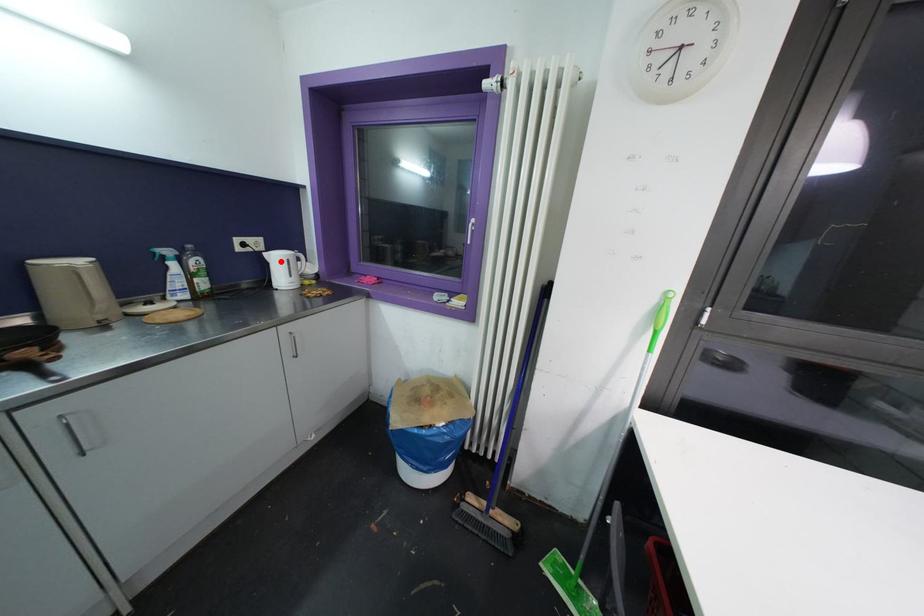
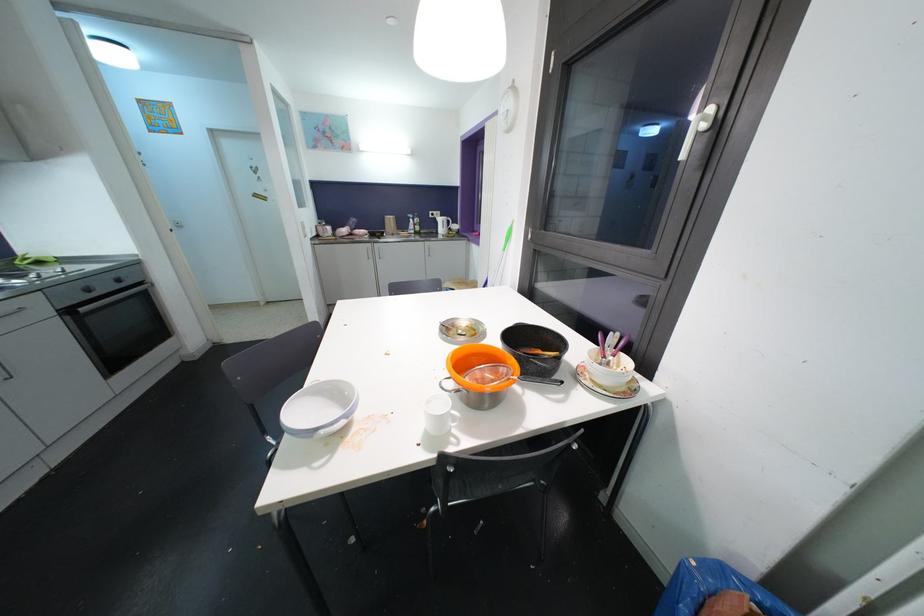
Locate, in the second image, the point that corresponds to the highlighted location in the first image.

(444, 223)